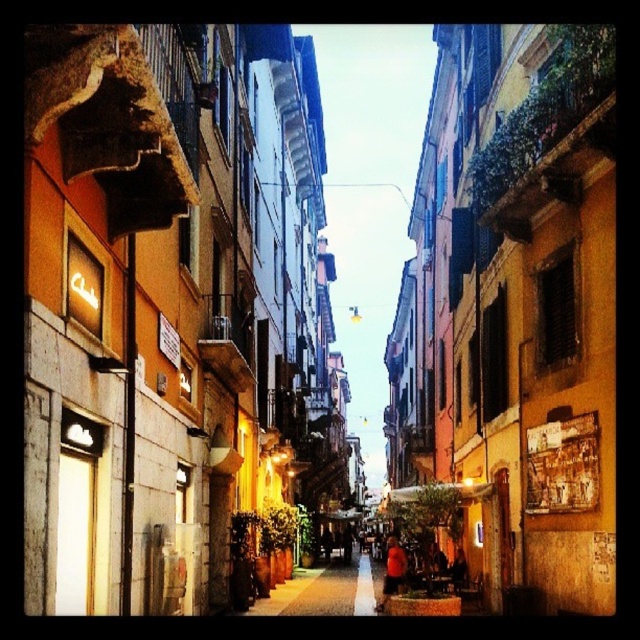
Who is taller, brown stone planter at center or orange fabric shirt at lower center?

Standing taller between the two is brown stone planter at center.

Find the location of a particular element. The image size is (640, 640). brown stone planter at center is located at coordinates tap(323, 592).